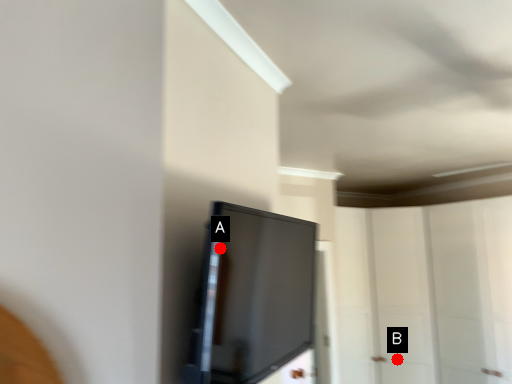
Question: Two points are circled on the image, labeled by A and B beside each circle. Which point is closer to the camera?

Choices:
 (A) A is closer
 (B) B is closer

Answer: (A)